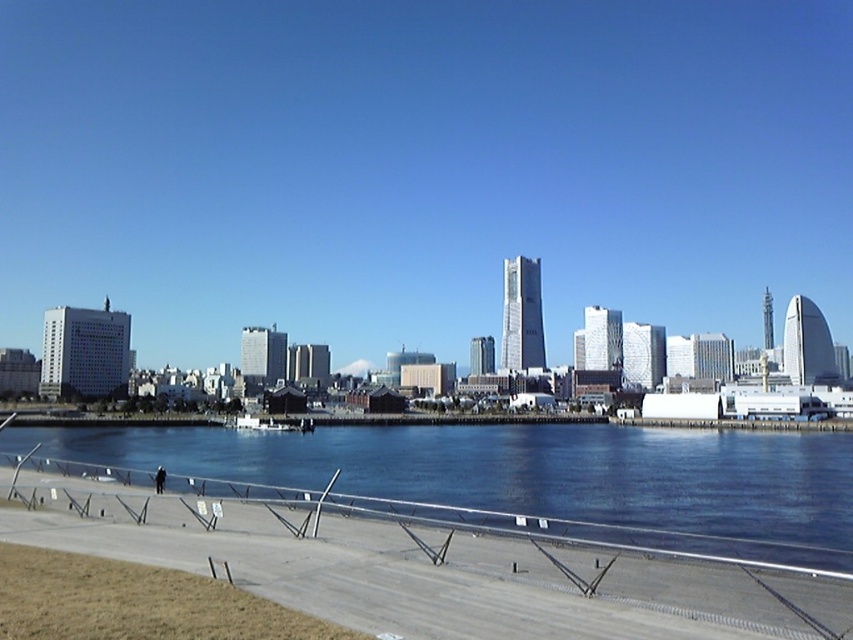
Question: Estimate the real-world distances between objects in this image. Which object is farther from the brown grass at lower left?

Choices:
 (A) transparent glass skyscrapers at center
 (B) blue glassy water at lower center

Answer: (A)

Question: Does blue glassy water at lower center have a lesser width compared to brown grass at lower left?

Choices:
 (A) no
 (B) yes

Answer: (A)

Question: Which object is the farthest from the blue glassy water at lower center?

Choices:
 (A) brown grass at lower left
 (B) transparent glass skyscrapers at center

Answer: (B)

Question: Does transparent glass skyscrapers at center appear on the left side of blue glassy water at lower center?

Choices:
 (A) no
 (B) yes

Answer: (A)

Question: Which object is farther from the camera taking this photo?

Choices:
 (A) transparent glass skyscrapers at center
 (B) brown grass at lower left

Answer: (A)

Question: Does blue glassy water at lower center have a larger size compared to brown grass at lower left?

Choices:
 (A) yes
 (B) no

Answer: (A)